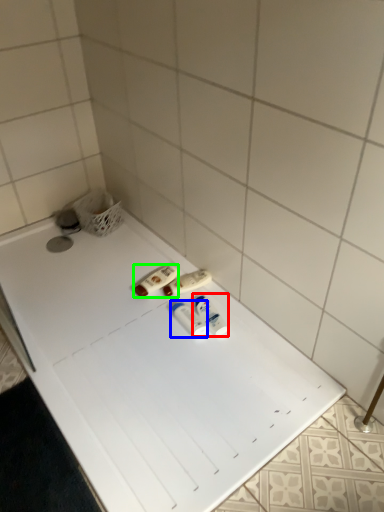
Question: Considering the real-world distances, which object is closest to toiletry (highlighted by a red box)? toiletry (highlighted by a blue box) or toiletry (highlighted by a green box).

Choices:
 (A) toiletry
 (B) toiletry

Answer: (A)